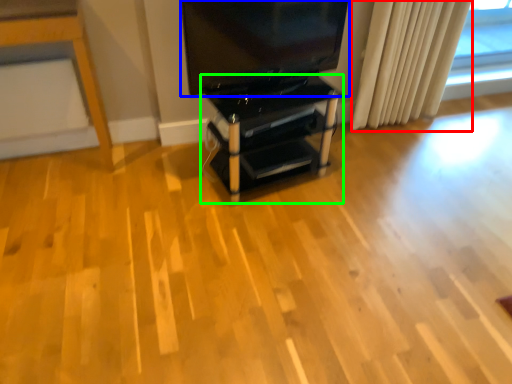
Question: Considering the real-world distances, which object is farthest from curtain (highlighted by a red box)? television (highlighted by a blue box) or furniture (highlighted by a green box)?

Choices:
 (A) television
 (B) furniture

Answer: (B)